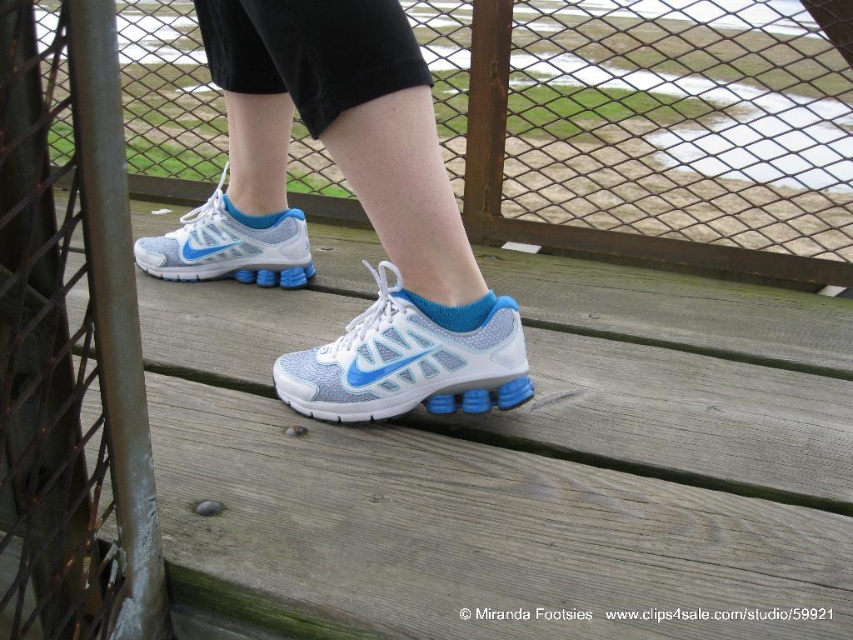
Based on the photo, who is positioned more to the right, green metal pole at left or light blue mesh shoe at center?

Positioned to the right is light blue mesh shoe at center.

Does green metal pole at left appear over light blue mesh shoe at center?

Yes, green metal pole at left is above light blue mesh shoe at center.

Who is more distant from viewer, (120, 170) or (444, 368)?

The point (444, 368) is behind.

Find the location of a particular element. This screenshot has width=853, height=640. green metal pole at left is located at coordinates (70, 346).

Between light blue mesh shoe at center and matte mesh shoe at center, which one appears on the right side from the viewer's perspective?

light blue mesh shoe at center is more to the right.

Who is lower down, light blue mesh shoe at center or matte mesh shoe at center?

Positioned lower is light blue mesh shoe at center.

Image resolution: width=853 pixels, height=640 pixels. Identify the location of light blue mesh shoe at center. (409, 358).

Is metal mesh fence at upper left shorter than green metal pole at left?

Correct, metal mesh fence at upper left is not as tall as green metal pole at left.

The width and height of the screenshot is (853, 640). In order to click on metal mesh fence at upper left in this screenshot , I will do `click(648, 131)`.